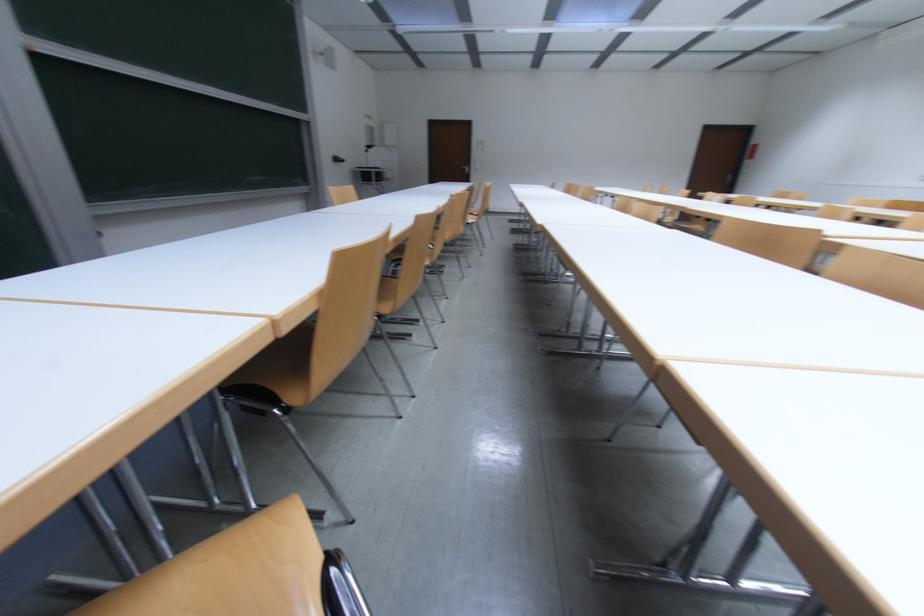
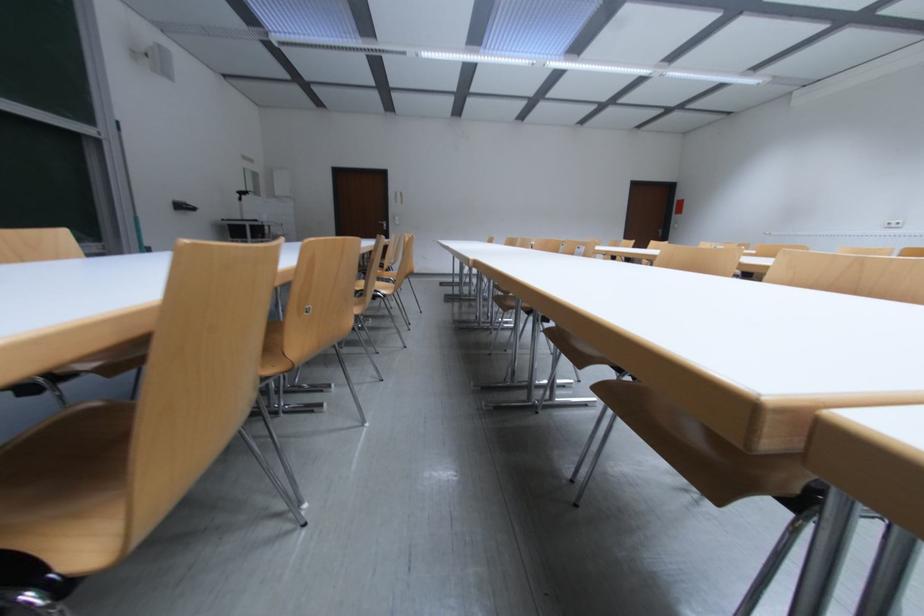
Question: In a continuous first-person perspective shot, in which direction is the camera moving?

Choices:
 (A) Left
 (B) Right
 (C) Forward
 (D) Backward

Answer: (C)